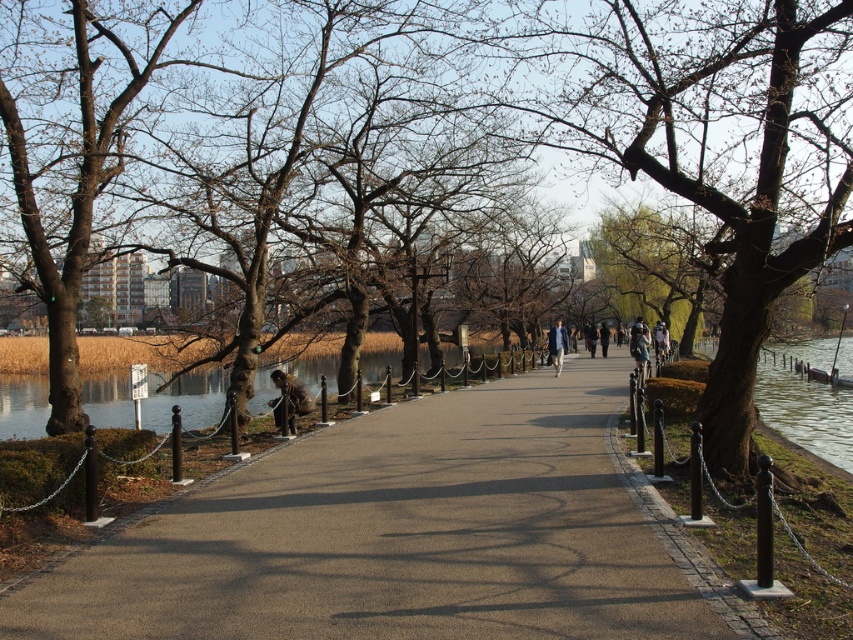
Is smooth asphalt path at center behind brown bark tree at center?

No, it is in front of brown bark tree at center.

Can you confirm if smooth asphalt path at center is smaller than brown bark tree at center?

Indeed, smooth asphalt path at center has a smaller size compared to brown bark tree at center.

Does point (466, 456) lie behind point (622, 116)?

No, it is in front of (622, 116).

The width and height of the screenshot is (853, 640). What are the coordinates of `smooth asphalt path at center` in the screenshot? It's located at (401, 534).

Which is below, denim jacket at center or light brown leather jacket at center?

light brown leather jacket at center is lower down.

Where is `denim jacket at center`? The height and width of the screenshot is (640, 853). denim jacket at center is located at coordinates (639, 346).

Looking at this image, who is lower down, blue fabric jacket at center or light brown leather jacket at center?

light brown leather jacket at center is below.

From the picture: Is blue fabric jacket at center smaller than light brown leather jacket at center?

No, blue fabric jacket at center is not smaller than light brown leather jacket at center.

Who is more forward, (547, 332) or (654, 344)?

Positioned in front is point (654, 344).

Locate an element on the screen. blue fabric jacket at center is located at coordinates (556, 344).